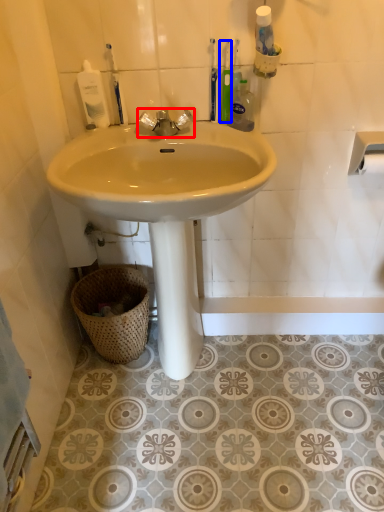
Question: Which object is further to the camera taking this photo, tap (highlighted by a red box) or toothbrush (highlighted by a blue box)?

Choices:
 (A) tap
 (B) toothbrush

Answer: (B)